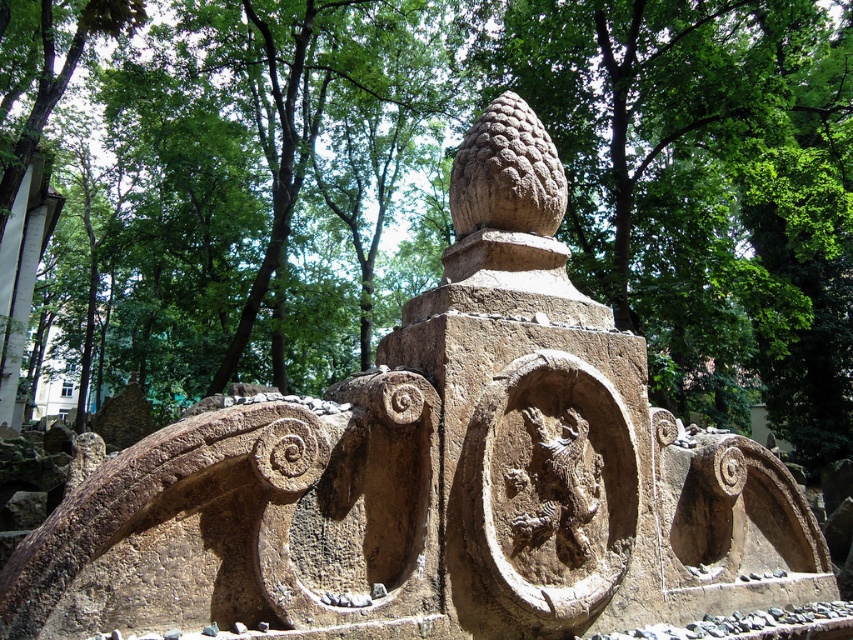
Which is below, brown stone tree at center or rough stone dragon at center?

rough stone dragon at center

Which of these two, brown stone tree at center or rough stone dragon at center, stands taller?

With more height is brown stone tree at center.

Is point (258, 19) more distant than point (599, 456)?

Yes, point (258, 19) is farther from viewer.

Where is `brown stone tree at center`? The width and height of the screenshot is (853, 640). brown stone tree at center is located at coordinates (444, 189).